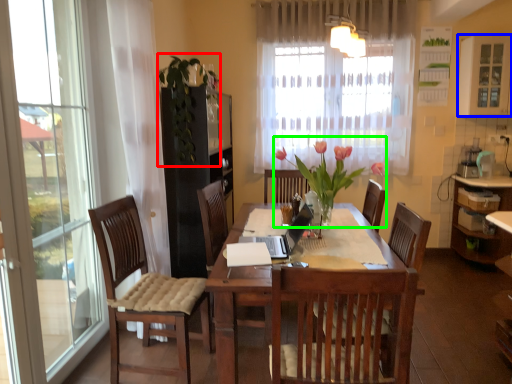
Question: Estimate the real-world distances between objects in this image. Which object is farther from floral arrangement (highlighted by a red box), window (highlighted by a blue box) or floral arrangement (highlighted by a green box)?

Choices:
 (A) window
 (B) floral arrangement

Answer: (A)